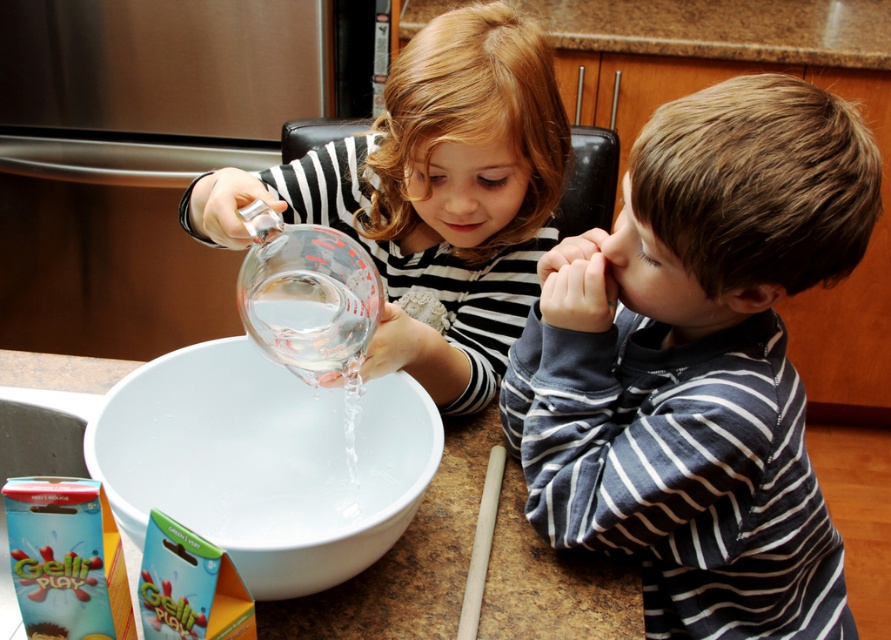
You are a parent in the kitchen and want to ensure the children are safe. The dark blue striped shirt at right and the white glossy bowl at center are part of the scene. Which object is located above the other?

The dark blue striped shirt at right is positioned over the white glossy bowl at center, meaning the shirt is above the bowl.

You are a parent in the kitchen and want to ensure the children are positioned safely away from the water activity. Which child is closer to the water source, the dark blue striped shirt at right or the white glossy bowl at center?

The dark blue striped shirt at right is to the right of the white glossy bowl at center, so the child in the dark blue striped shirt at right is farther away from the water source compared to the child near the white glossy bowl at center.